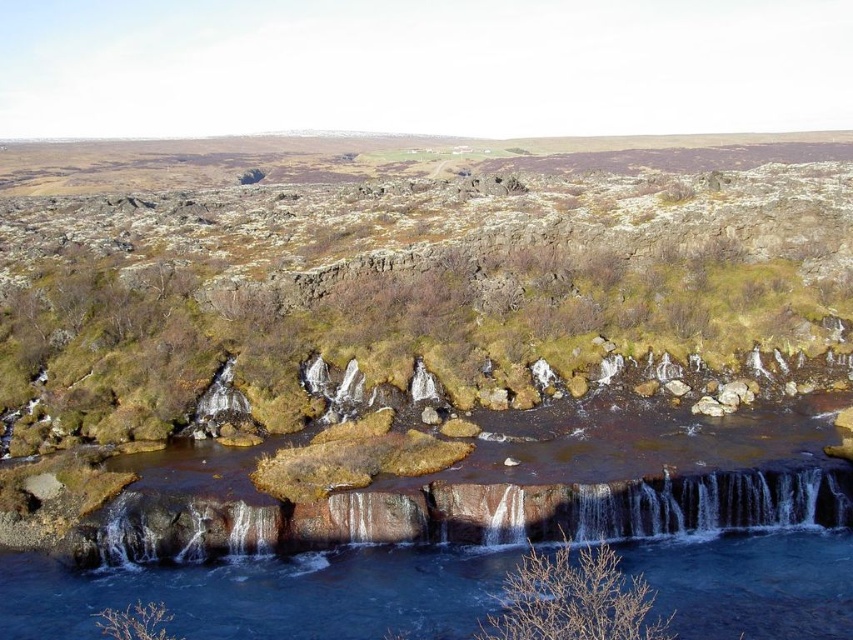
You are a hiker trying to cross the river. You see the brown rock river at center and the smooth rock waterfall at center. Which one is closer to you?

The brown rock river at center is closer to you because it is in front of the smooth rock waterfall at center.

You are a hiker who wants to cross the brown rock river at center. There is a green mossy rock at center nearby. Which direction should you go to avoid stepping into the river?

The green mossy rock at center is above the brown rock river at center, so you should go upward to the green mossy rock at center to avoid stepping into the river.